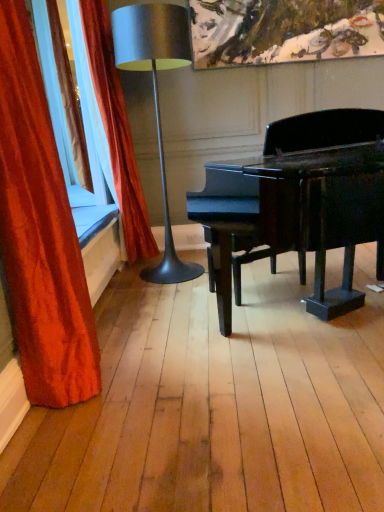
This screenshot has height=512, width=384. Identify the location of free point behind velvet red curtain at left, the second curtain viewed from the back. (123, 336).